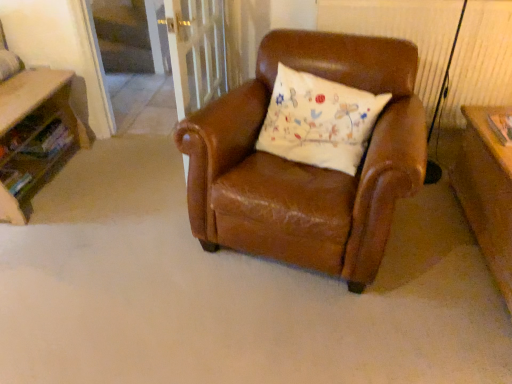
Image resolution: width=512 pixels, height=384 pixels. I want to click on clear glass screen door at upper center, so click(x=131, y=36).

Describe the element at coordinates (131, 36) in the screenshot. I see `clear glass screen door at upper center` at that location.

Image resolution: width=512 pixels, height=384 pixels. Identify the location of clear glass screen door at upper center. pyautogui.click(x=131, y=36).

Does point (304, 82) appear closer or farther from the camera than point (30, 101)?

Clearly, point (304, 82) is closer to the camera than point (30, 101).

Locate an element on the screen. pillow in front of the wooden table at left is located at coordinates (319, 121).

Does white embroidered pillow at center have a lesser height compared to wooden table at left?

No.

Would you say white embroidered pillow at center is to the left or to the right of wooden table at left in the picture?

Based on their positions, white embroidered pillow at center is located to the right of wooden table at left.

From the image's perspective, is clear glass screen door at upper center located above or below white embroidered pillow at center?

Based on their image positions, clear glass screen door at upper center is located above white embroidered pillow at center.

Is point (111, 1) in front of point (317, 103)?

No.

Considering the relative sizes of clear glass screen door at upper center and white embroidered pillow at center in the image provided, is clear glass screen door at upper center taller than white embroidered pillow at center?

Indeed, clear glass screen door at upper center has a greater height compared to white embroidered pillow at center.

Does clear glass screen door at upper center lie behind white embroidered pillow at center?

Yes, the depth of clear glass screen door at upper center is greater than that of white embroidered pillow at center.

Between wooden table at left and white embroidered pillow at center, which one appears on the left side from the viewer's perspective?

From the viewer's perspective, wooden table at left appears more on the left side.

Considering the relative sizes of wooden table at left and white embroidered pillow at center in the image provided, is wooden table at left shorter than white embroidered pillow at center?

Correct, wooden table at left is not as tall as white embroidered pillow at center.

From the image's perspective, which is above, wooden table at left or white embroidered pillow at center?

From the image's view, white embroidered pillow at center is above.

Is white embroidered pillow at center completely or partially inside wooden table at left?

No, white embroidered pillow at center is not surrounded by wooden table at left.

In the scene shown: Considering the sizes of objects clear glass screen door at upper center and wooden table at left in the image provided, who is thinner, clear glass screen door at upper center or wooden table at left?

Thinner between the two is clear glass screen door at upper center.

Based on the photo, does clear glass screen door at upper center turn towards wooden table at left?

Yes.

Is clear glass screen door at upper center positioned far away from wooden table at left?

That's right, there is a large distance between clear glass screen door at upper center and wooden table at left.

Identify the location of screen door that is behind the wooden table at left. Image resolution: width=512 pixels, height=384 pixels. (131, 36).

Is white embroidered pillow at center with clear glass screen door at upper center?

No, white embroidered pillow at center is not next to clear glass screen door at upper center.

Can you confirm if white embroidered pillow at center is smaller than clear glass screen door at upper center?

Indeed, white embroidered pillow at center has a smaller size compared to clear glass screen door at upper center.

Considering the sizes of objects white embroidered pillow at center and clear glass screen door at upper center in the image provided, who is shorter, white embroidered pillow at center or clear glass screen door at upper center?

white embroidered pillow at center is shorter.

Is white embroidered pillow at center positioned before clear glass screen door at upper center?

Yes, white embroidered pillow at center is closer to the viewer.

From a real-world perspective, is wooden table at left beneath clear glass screen door at upper center?

Yes, from a real-world perspective, wooden table at left is beneath clear glass screen door at upper center.

From the image's perspective, is wooden table at left above or below clear glass screen door at upper center?

wooden table at left is below clear glass screen door at upper center.

Is point (53, 167) positioned in front of point (130, 59)?

Yes, point (53, 167) is in front of point (130, 59).

In terms of height, does wooden table at left look taller or shorter compared to clear glass screen door at upper center?

Clearly, wooden table at left is shorter compared to clear glass screen door at upper center.

The height and width of the screenshot is (384, 512). Identify the location of pillow above the wooden table at left (from a real-world perspective). (319, 121).

Find the location of a particular element. This screenshot has width=512, height=384. screen door on the left of the white embroidered pillow at center is located at coordinates (131, 36).

When comparing their distances from white embroidered pillow at center, does wooden table at left or clear glass screen door at upper center seem closer?

Among the two, wooden table at left is located nearer to white embroidered pillow at center.

From the image, which object appears to be farther from clear glass screen door at upper center, white embroidered pillow at center or wooden table at left?

The object further to clear glass screen door at upper center is white embroidered pillow at center.

When comparing their distances from wooden table at left, does white embroidered pillow at center or clear glass screen door at upper center seem further?

Based on the image, white embroidered pillow at center appears to be further to wooden table at left.

Estimate the real-world distances between objects in this image. Which object is closer to wooden table at left, clear glass screen door at upper center or white embroidered pillow at center?

The object closer to wooden table at left is clear glass screen door at upper center.

Looking at this image, from the image, which object appears to be farther from clear glass screen door at upper center, wooden table at left or white embroidered pillow at center?

Among the two, white embroidered pillow at center is located further to clear glass screen door at upper center.

Which object lies further to the anchor point white embroidered pillow at center, clear glass screen door at upper center or wooden table at left?

Among the two, clear glass screen door at upper center is located further to white embroidered pillow at center.

Image resolution: width=512 pixels, height=384 pixels. Find the location of `screen door between wooden table at left and white embroidered pillow at center from left to right`. screen door between wooden table at left and white embroidered pillow at center from left to right is located at coordinates (131, 36).